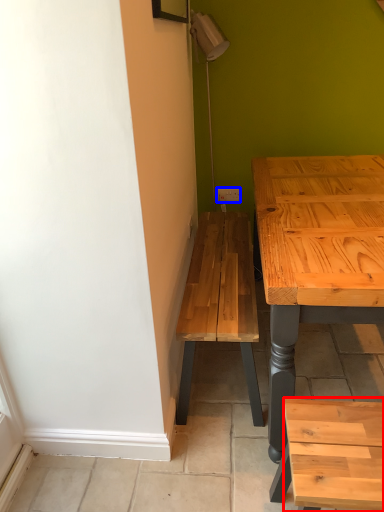
Question: Which of the following is the closest to the observer, stool (highlighted by a red box) or electric outlet (highlighted by a blue box)?

Choices:
 (A) stool
 (B) electric outlet

Answer: (A)